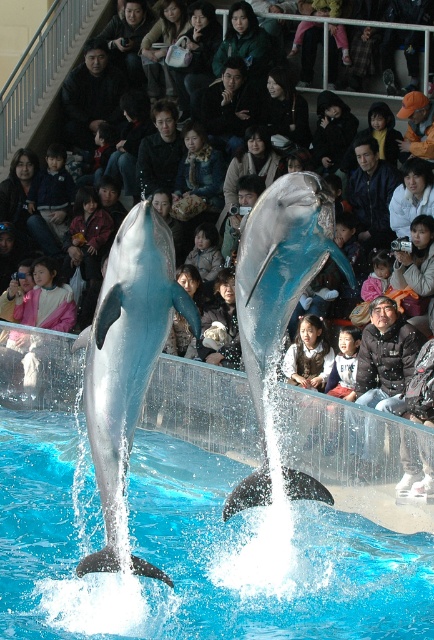
You are a visitor sitting in the front row of the dolphin show. You notice a point marked at coordinates (188, 552). What is located at this point in the scene?

The point at coordinates (188, 552) marks transparent glass water at center.

You are a photographer at the dolphin show and need to capture both the black textured jacket at center and the black leather jacket at upper center in your shot. Which jacket is positioned to the right of the other?

The black textured jacket at center is to the right of the black leather jacket at upper center.

You are a photographer positioned at the front row of the dolphin show. You want to take a photo that includes both the two jumping dolphins and the crowd of spectators. You have two points marked in your viewfinder at coordinates point [36,448] and point [308,200]. Which point should you focus on first to ensure both subjects are in focus?

You should focus on point [36,448] first because it is closer to the camera than point [308,200]. This ensures that the closer subject will be in focus while the farther one may still be within the depth of field.